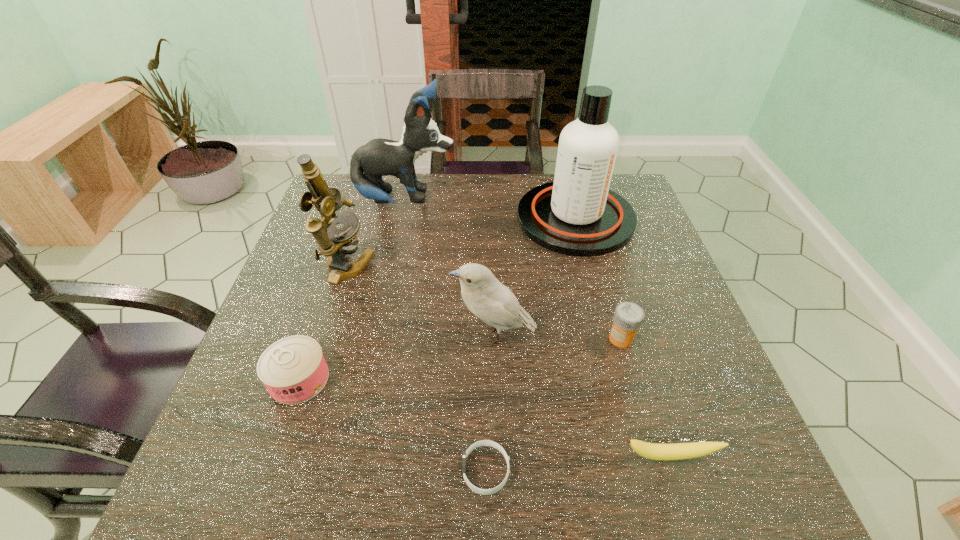
At what (x,y) coordinates should I click in order to perform the action: click on medicine at the right edge. Please return your answer as a coordinate pair (x, y). The image size is (960, 540). Looking at the image, I should click on (628, 316).

What are the coordinates of `banana that is at the right edge` in the screenshot? It's located at (661, 452).

What are the coordinates of `object located in the far left corner section of the desktop` in the screenshot? It's located at (379, 157).

The height and width of the screenshot is (540, 960). In order to click on object that is at the far right corner in this screenshot , I will do `click(577, 214)`.

Where is `object positioned at the near right corner`? object positioned at the near right corner is located at coordinates (661, 452).

Where is `vacant space at the far edge`? Image resolution: width=960 pixels, height=540 pixels. vacant space at the far edge is located at coordinates (483, 201).

In the image, there is a desktop. Where is `vacant space at the near edge`? Image resolution: width=960 pixels, height=540 pixels. vacant space at the near edge is located at coordinates (570, 456).

In the image, there is a desktop. Where is `vacant space at the left edge`? Image resolution: width=960 pixels, height=540 pixels. vacant space at the left edge is located at coordinates (252, 352).

Identify the location of vacant space at the right edge of the desktop. (694, 337).

Find the location of a particular element. Image resolution: width=960 pixels, height=540 pixels. free space at the near left corner of the desktop is located at coordinates (201, 462).